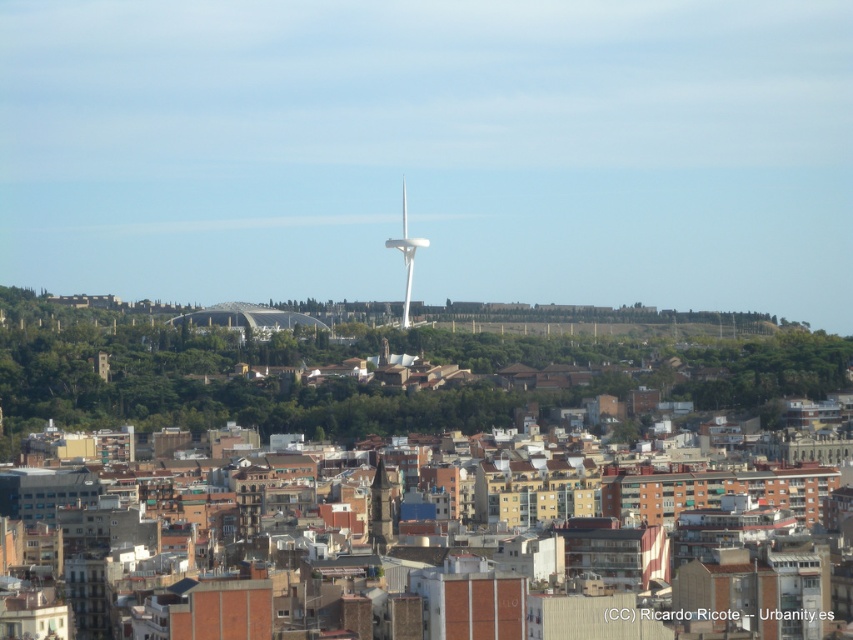
Question: Which of the following is the farthest from the observer?

Choices:
 (A) (380, 518)
 (B) (409, 291)

Answer: (B)

Question: Is dark brown stone tower at center smaller than white smooth wind turbine at center?

Choices:
 (A) no
 (B) yes

Answer: (B)

Question: Among these objects, which one is farthest from the camera?

Choices:
 (A) white smooth wind turbine at center
 (B) dark brown stone tower at center

Answer: (A)

Question: Does dark brown stone tower at center appear over white smooth wind turbine at center?

Choices:
 (A) yes
 (B) no

Answer: (B)

Question: Is dark brown stone tower at center smaller than white smooth wind turbine at center?

Choices:
 (A) yes
 (B) no

Answer: (A)

Question: Which point is farther from the camera taking this photo?

Choices:
 (A) (402, 252)
 (B) (389, 531)

Answer: (A)